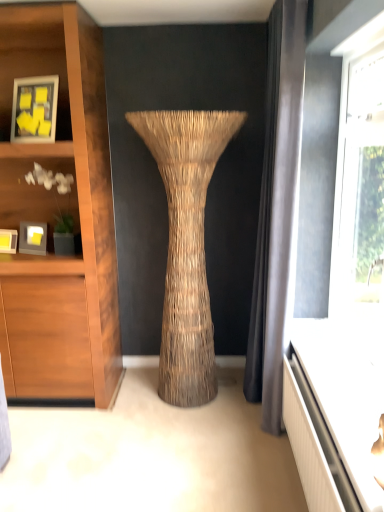
Question: From a real-world perspective, is matte yellow paper at upper left, which is the first picture frame in top-to-bottom order, located beneath matte black picture frame at left, the first picture frame from the bottom?

Choices:
 (A) no
 (B) yes

Answer: (A)

Question: Is matte yellow paper at upper left, which is the third picture frame in bottom-to-top order, at the right side of matte black picture frame at left, positioned as the 3th picture frame in top-to-bottom order?

Choices:
 (A) yes
 (B) no

Answer: (A)

Question: Does matte yellow paper at upper left, which is the third picture frame in bottom-to-top order, have a smaller size compared to matte black picture frame at left, the first picture frame from the bottom?

Choices:
 (A) no
 (B) yes

Answer: (A)

Question: Is matte yellow paper at upper left, which is the first picture frame in top-to-bottom order, bigger than matte black picture frame at left, the first picture frame from the bottom?

Choices:
 (A) yes
 (B) no

Answer: (A)

Question: Could you tell me if matte yellow paper at upper left, which is the first picture frame in top-to-bottom order, is turned towards matte black picture frame at left, positioned as the 3th picture frame in top-to-bottom order?

Choices:
 (A) yes
 (B) no

Answer: (B)

Question: From the image's perspective, is matte yellow paper at upper left, which is the first picture frame in top-to-bottom order, above matte black picture frame at left, positioned as the 3th picture frame in top-to-bottom order?

Choices:
 (A) yes
 (B) no

Answer: (A)

Question: Is matte black picture frame at left, the second picture frame when ordered from top to bottom, oriented away from white glossy vanity at lower right?

Choices:
 (A) no
 (B) yes

Answer: (A)

Question: Can you confirm if matte black picture frame at left, the second picture frame when ordered from top to bottom, is shorter than white glossy vanity at lower right?

Choices:
 (A) yes
 (B) no

Answer: (B)

Question: From a real-world perspective, is matte black picture frame at left, the second picture frame when ordered from top to bottom, located beneath white glossy vanity at lower right?

Choices:
 (A) no
 (B) yes

Answer: (A)

Question: Considering the relative positions of matte black picture frame at left, the second picture frame from the bottom, and white glossy vanity at lower right in the image provided, is matte black picture frame at left, the second picture frame from the bottom, to the left of white glossy vanity at lower right from the viewer's perspective?

Choices:
 (A) yes
 (B) no

Answer: (A)

Question: Considering the relative sizes of matte black picture frame at left, the second picture frame when ordered from top to bottom, and white glossy vanity at lower right in the image provided, is matte black picture frame at left, the second picture frame when ordered from top to bottom, taller than white glossy vanity at lower right?

Choices:
 (A) yes
 (B) no

Answer: (A)

Question: Is matte black picture frame at left, the second picture frame from the bottom, wider than white glossy vanity at lower right?

Choices:
 (A) yes
 (B) no

Answer: (B)

Question: From the image's perspective, is matte black picture frame at left, the first picture frame from the bottom, below matte wood shelf at left?

Choices:
 (A) no
 (B) yes

Answer: (B)